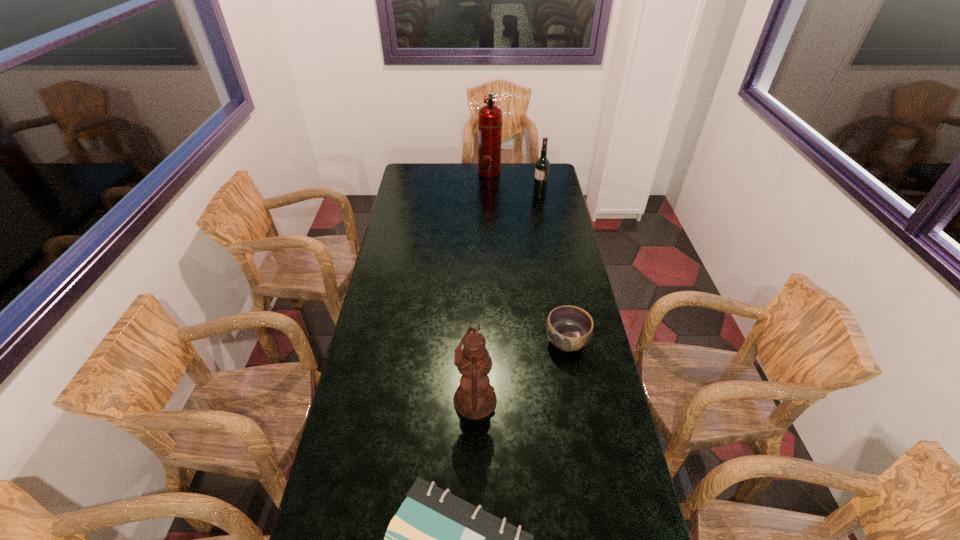
This screenshot has width=960, height=540. What are the coordinates of `the farthest object` in the screenshot? It's located at (490, 116).

Where is `the tallest object`? This screenshot has height=540, width=960. the tallest object is located at coordinates (490, 116).

Where is `the second farthest object`? The width and height of the screenshot is (960, 540). the second farthest object is located at coordinates (542, 166).

Find the location of a particular element. Image resolution: width=960 pixels, height=540 pixels. oil lamp is located at coordinates (475, 398).

Image resolution: width=960 pixels, height=540 pixels. Find the location of `bowl`. bowl is located at coordinates (569, 328).

In order to click on vacant space located 0.160m on the nozzle side of the farthest object in this screenshot , I will do `click(449, 172)`.

Find the location of `free region located on the nozzle side of the farthest object`. free region located on the nozzle side of the farthest object is located at coordinates 462,172.

The image size is (960, 540). I want to click on free space located on the nozzle side of the farthest object, so click(410, 172).

Locate an element on the screen. This screenshot has width=960, height=540. vacant space located on the front and back of the wine bottle is located at coordinates (506, 196).

Locate an element on the screen. free space located on the front and back of the wine bottle is located at coordinates (461, 196).